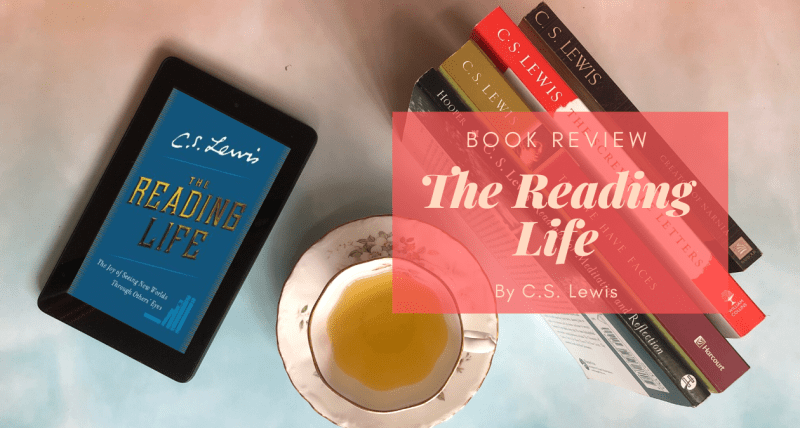
Where is `books clip art with the first dot indicating a book that is laying down the other four are standing up and increasing in size`? The image size is (800, 428). books clip art with the first dot indicating a book that is laying down the other four are standing up and increasing in size is located at coordinates (174, 319), (154, 321).